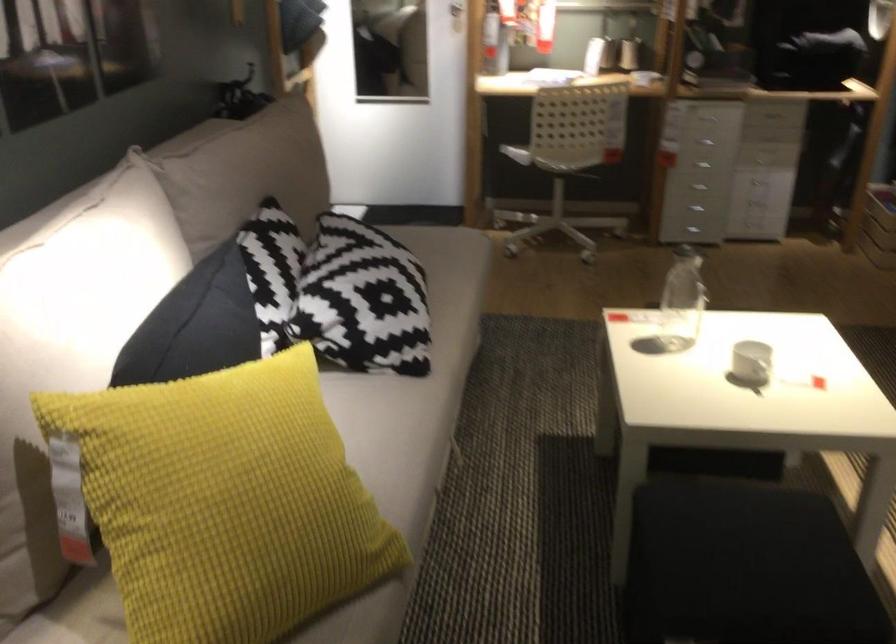
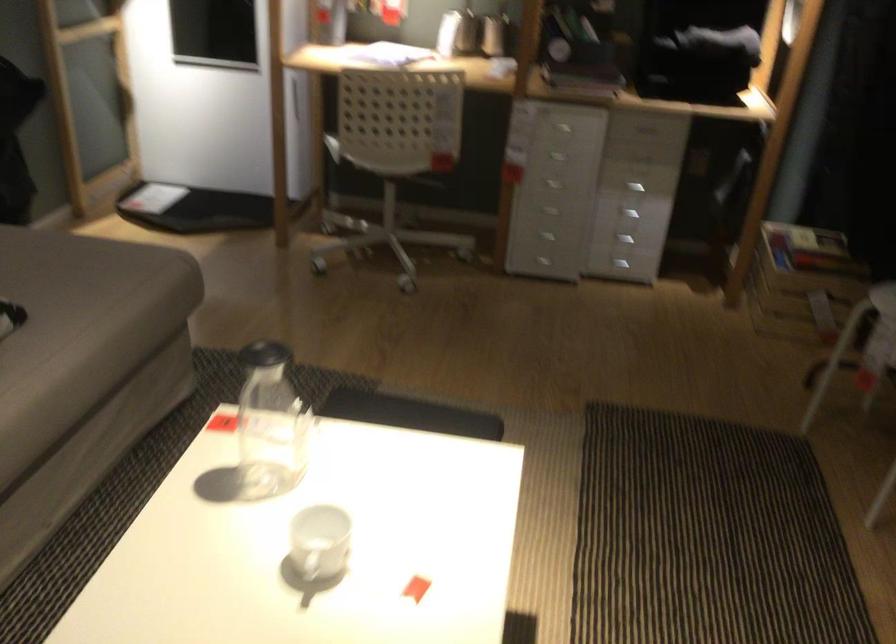
Where in the second image is the point corresponding to (x=776, y=171) from the first image?

(627, 214)